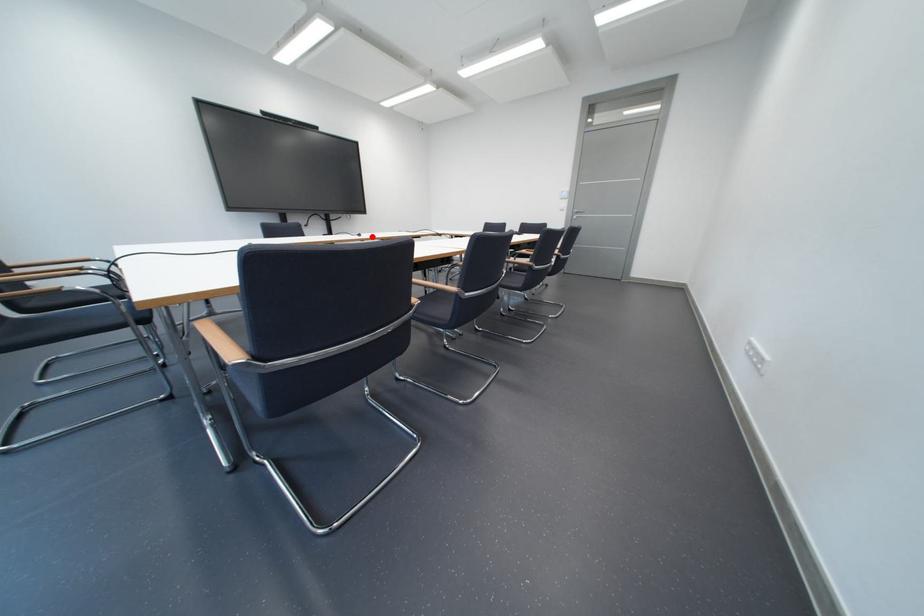
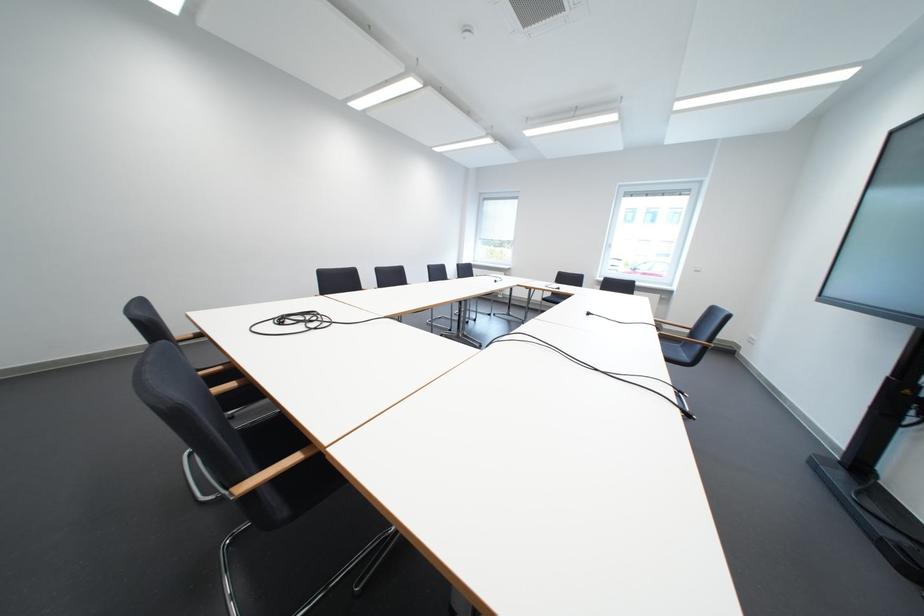
Question: I am providing you with two images of the same scene from different viewpoints. A red point is marked on the first image. Can you still see the location of the red point in image 2?

Choices:
 (A) Yes
 (B) No

Answer: (A)